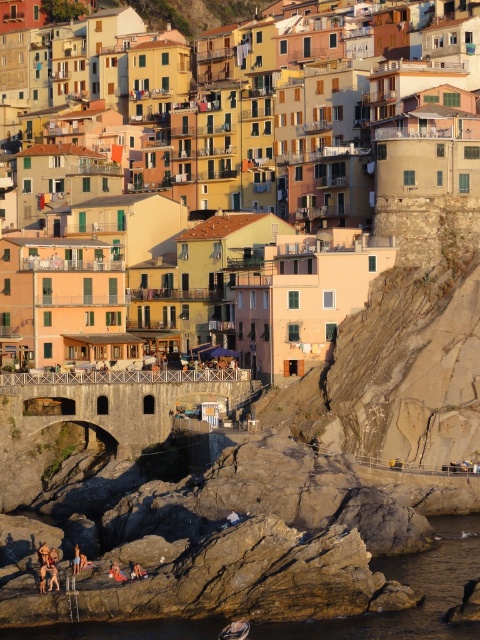
Is point (202, 77) less distant than point (464, 538)?

That is False.

Who is more distant from viewer, (396, 129) or (156, 634)?

Point (396, 129)

The height and width of the screenshot is (640, 480). What are the coordinates of `matte yellow building at center` in the screenshot? It's located at pos(331,122).

Is translucent water at lower center to the right of brown leather jacket at lower center from the viewer's perspective?

Indeed, translucent water at lower center is positioned on the right side of brown leather jacket at lower center.

In the scene shown: Is translucent water at lower center taller than brown leather jacket at lower center?

Yes.

At what (x,y) coordinates should I click in order to perform the action: click on translucent water at lower center. Please return your answer as a coordinate pair (x, y). The image size is (480, 640). Looking at the image, I should click on (412, 588).

Where is `metallic gray boat at lower center`? metallic gray boat at lower center is located at coordinates (235, 630).

Is metallic gray boat at lower center to the right of brown leather jacket at lower center from the viewer's perspective?

Yes, metallic gray boat at lower center is to the right of brown leather jacket at lower center.

Find the location of a particular element. Image resolution: width=480 pixels, height=640 pixels. metallic gray boat at lower center is located at coordinates (235, 630).